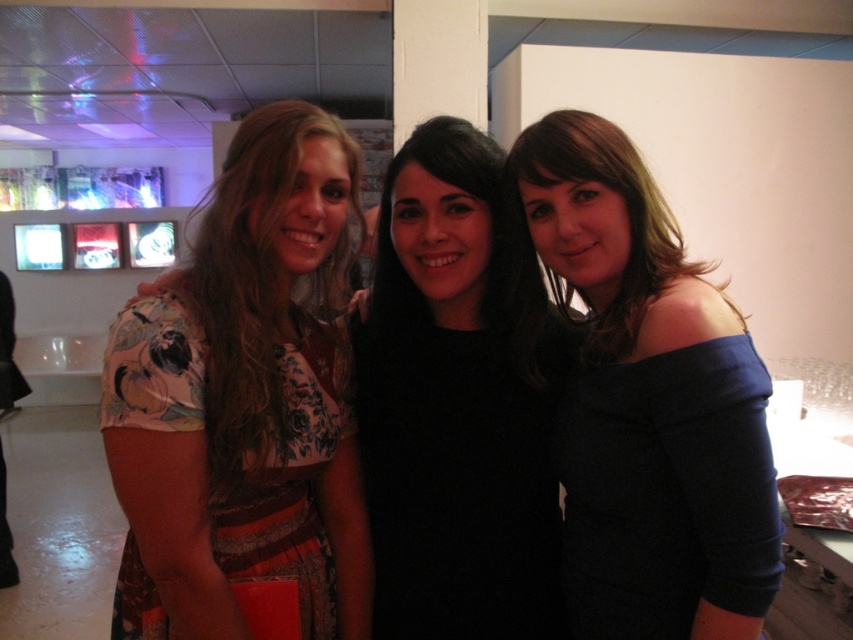
You are observing three women standing in a modern gallery space. The woman on the left wears a floral dress and holds a red item. The middle woman has straight black hair. You notice two dresses at the center of the scene labeled as the blue matte dress at center and the black matte dress at center. Which dress is positioned higher in the image?

The blue matte dress at center is located above the black matte dress at center, so the blue one is higher.